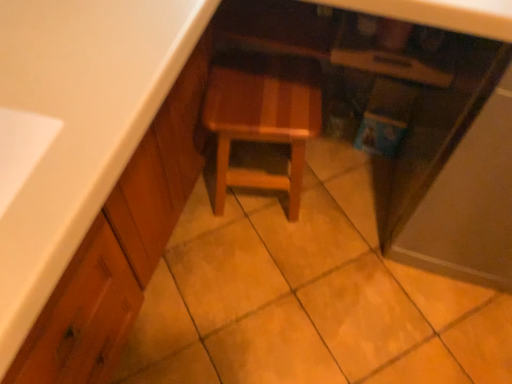
I want to click on vacant area on top of wooden stool at center (from a real-world perspective), so click(266, 92).